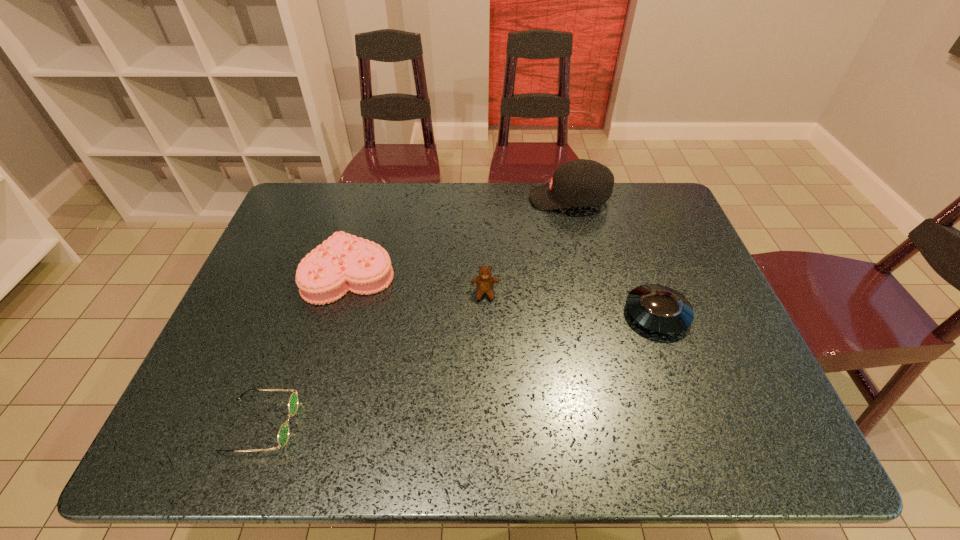
At what (x,y) coordinates should I click in order to perform the action: click on vacant area between the nearest object and the teddy bear. Please return your answer as a coordinate pair (x, y). Image resolution: width=960 pixels, height=540 pixels. Looking at the image, I should click on (372, 359).

Where is `blank region between the fourth shortest object and the nearest object`? Image resolution: width=960 pixels, height=540 pixels. blank region between the fourth shortest object and the nearest object is located at coordinates [372, 359].

Locate an element on the screen. The width and height of the screenshot is (960, 540). vacant space that's between the spectacles and the third shortest object is located at coordinates (305, 349).

In order to click on vacant space that is in between the nearest object and the teddy bear in this screenshot , I will do `click(372, 359)`.

You are a GUI agent. You are given a task and a screenshot of the screen. Output one action in this format:
    pyautogui.click(x=<x>, y=<y>)
    Task: Click on the free space that is in between the third object from right to left and the saucer
    The height and width of the screenshot is (540, 960).
    Given the screenshot: What is the action you would take?
    pyautogui.click(x=571, y=303)

This screenshot has width=960, height=540. Find the location of `vacant region between the cake and the saucer`. vacant region between the cake and the saucer is located at coordinates (503, 293).

Image resolution: width=960 pixels, height=540 pixels. I want to click on free space between the teddy bear and the saucer, so click(x=571, y=303).

Locate an element on the screen. object that is the fourth nearest to the fourth shortest object is located at coordinates (283, 433).

At what (x,y) coordinates should I click in order to perform the action: click on object that is the third closest to the cake. Please return your answer as a coordinate pair (x, y). Looking at the image, I should click on (578, 183).

Locate an element on the screen. free space in the image that satisfies the following two spatial constraints: 1. with a logo on the front of the second shortest object; 2. on the right side of the tallest object is located at coordinates (596, 314).